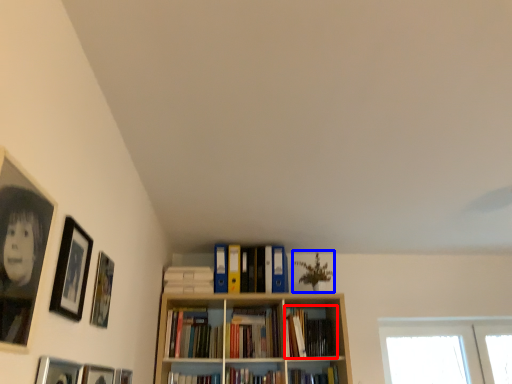
Question: Which point is closer to the camera, book (highlighted by a red box) or plant (highlighted by a blue box)?

Choices:
 (A) book
 (B) plant

Answer: (A)